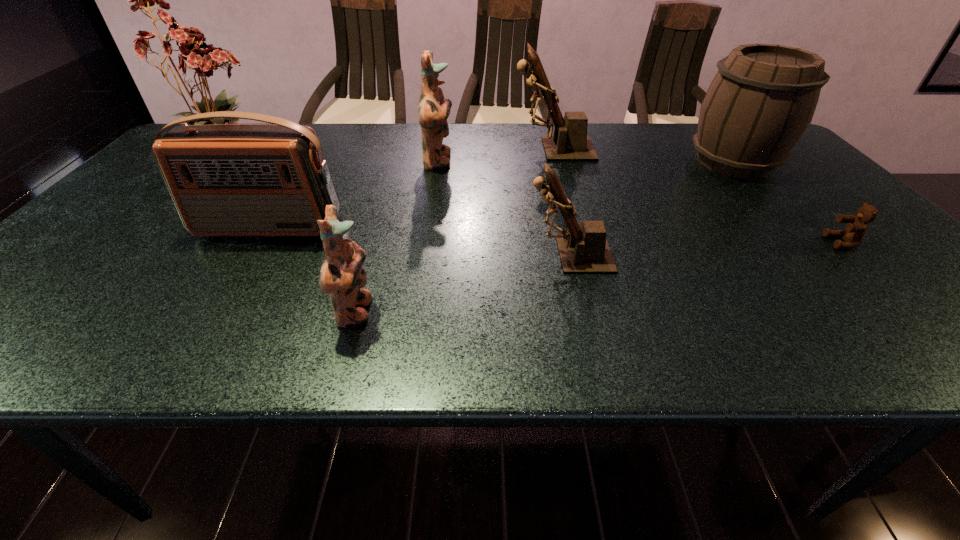
Locate an element on the screen. the left pink figurine is located at coordinates (342, 275).

Locate an element on the screen. This screenshot has height=540, width=960. teddy bear is located at coordinates (856, 228).

Locate an element on the screen. The width and height of the screenshot is (960, 540). vacant region located on the front-facing side of the pink flower arrangement is located at coordinates (379, 155).

Identify the location of free region located 0.200m on the front-facing side of the bigger brown figurine. This screenshot has width=960, height=540. (447, 149).

Identify the location of vacant space located 0.090m on the front-facing side of the bigger brown figurine. (483, 149).

This screenshot has width=960, height=540. Find the location of `free space located 0.180m on the front-facing side of the bigger brown figurine`. free space located 0.180m on the front-facing side of the bigger brown figurine is located at coordinates (454, 149).

The width and height of the screenshot is (960, 540). In order to click on vacant region located on the front-facing side of the fifth object from right to left in this screenshot , I will do `click(591, 162)`.

Locate an element on the screen. free spot located 0.360m on the front of the wine bucket is located at coordinates (835, 275).

Identify the location of free space located 0.280m on the front-facing side of the radio receiver. Image resolution: width=960 pixels, height=540 pixels. (203, 337).

Identify the location of vacant space located 0.220m on the front-facing side of the nearer brown figurine. (426, 256).